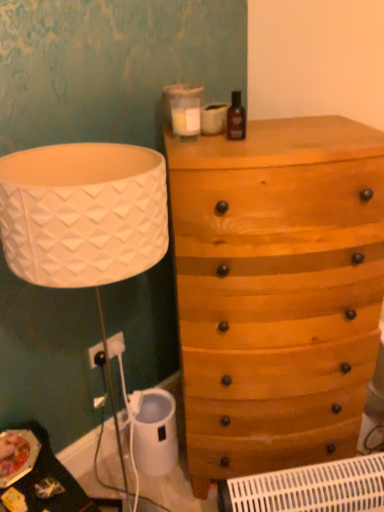
Where is `vacant point above wooden chest of drawers at upper right (from a real-world perspective)`? Image resolution: width=384 pixels, height=512 pixels. vacant point above wooden chest of drawers at upper right (from a real-world perspective) is located at coordinates (279, 135).